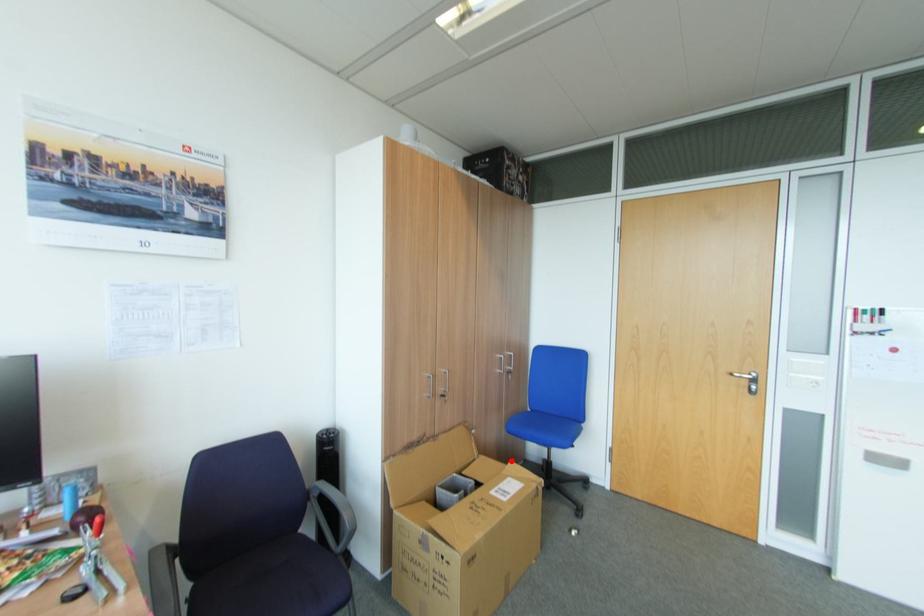
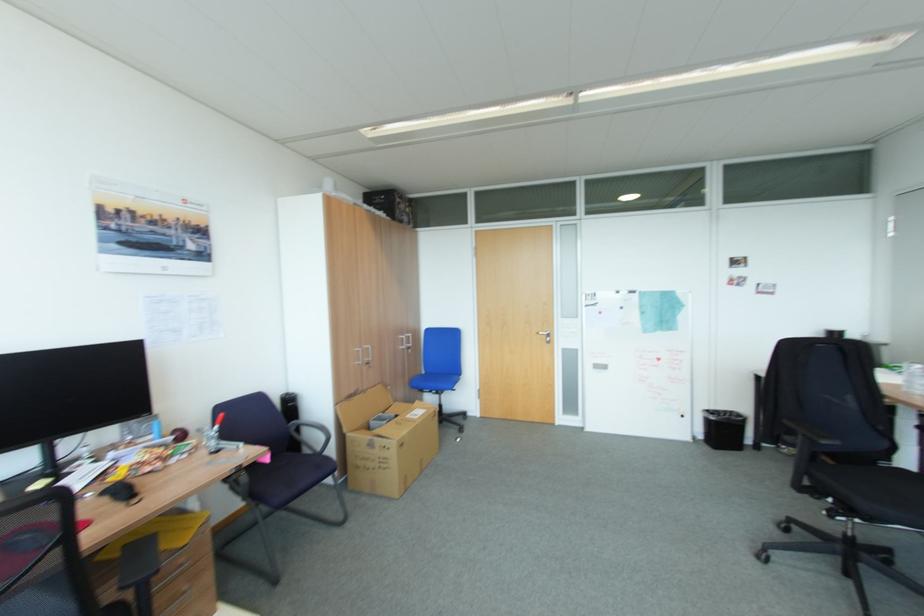
The point at the highlighted location is marked in the first image. Where is the corresponding point in the second image?

(419, 403)